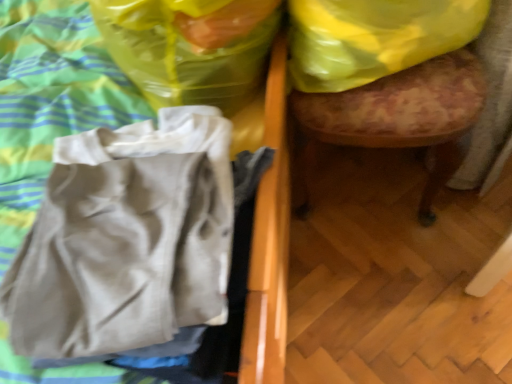
This screenshot has height=384, width=512. What are the coordinates of `beige cotton shirt at left` in the screenshot? It's located at (126, 239).

In order to face translucent yellow plastic bag at upper right, which ranks as the 1th plastic bag in left-to-right order, should I rotate leftwards or rightwards?

You should look left and rotate roughly 8.756 degrees.

This screenshot has height=384, width=512. In order to click on yellow plastic bag at upper right, the 2th plastic bag from the left in this screenshot , I will do `click(374, 38)`.

Would you say wooden upholstered stool at right is to the left or to the right of translucent yellow plastic bag at upper right, which ranks as the 1th plastic bag in left-to-right order, in the picture?

In the image, wooden upholstered stool at right appears on the right side of translucent yellow plastic bag at upper right, which ranks as the 1th plastic bag in left-to-right order.

Is wooden upholstered stool at right shorter than translucent yellow plastic bag at upper right, which ranks as the 2th plastic bag in right-to-left order?

No, wooden upholstered stool at right is not shorter than translucent yellow plastic bag at upper right, which ranks as the 2th plastic bag in right-to-left order.

Is translucent yellow plastic bag at upper right, which ranks as the 1th plastic bag in left-to-right order, surrounded by wooden upholstered stool at right?

That's incorrect, translucent yellow plastic bag at upper right, which ranks as the 1th plastic bag in left-to-right order, is not inside wooden upholstered stool at right.

In the scene shown: Considering the relative sizes of wooden upholstered stool at right and translucent yellow plastic bag at upper right, which ranks as the 2th plastic bag in right-to-left order, in the image provided, is wooden upholstered stool at right smaller than translucent yellow plastic bag at upper right, which ranks as the 2th plastic bag in right-to-left order,?

Incorrect, wooden upholstered stool at right is not smaller in size than translucent yellow plastic bag at upper right, which ranks as the 2th plastic bag in right-to-left order.

Considering the relative sizes of yellow plastic bag at upper right, the 2th plastic bag from the left, and wooden upholstered stool at right in the image provided, is yellow plastic bag at upper right, the 2th plastic bag from the left, wider than wooden upholstered stool at right?

In fact, yellow plastic bag at upper right, the 2th plastic bag from the left, might be narrower than wooden upholstered stool at right.

Consider the image. Is wooden upholstered stool at right at the back of yellow plastic bag at upper right, the 1th plastic bag viewed from the right?

Yes, yellow plastic bag at upper right, the 1th plastic bag viewed from the right, is positioned with its back facing wooden upholstered stool at right.

Is yellow plastic bag at upper right, the 2th plastic bag from the left, completely or partially outside of wooden upholstered stool at right?

Actually, yellow plastic bag at upper right, the 2th plastic bag from the left, is within wooden upholstered stool at right.

Which object is further away from the camera, yellow plastic bag at upper right, the 1th plastic bag viewed from the right, or wooden upholstered stool at right?

yellow plastic bag at upper right, the 1th plastic bag viewed from the right.

Consider the image. Measure the distance from translucent yellow plastic bag at upper right, which ranks as the 2th plastic bag in right-to-left order, to wooden upholstered stool at right.

They are 11.44 inches apart.

Is translucent yellow plastic bag at upper right, which ranks as the 2th plastic bag in right-to-left order, further to the viewer compared to wooden upholstered stool at right?

No, it is not.

From the image's perspective, which is below, translucent yellow plastic bag at upper right, which ranks as the 2th plastic bag in right-to-left order, or wooden upholstered stool at right?

From the image's view, wooden upholstered stool at right is below.

Is translucent yellow plastic bag at upper right, which ranks as the 1th plastic bag in left-to-right order, smaller than wooden upholstered stool at right?

Indeed, translucent yellow plastic bag at upper right, which ranks as the 1th plastic bag in left-to-right order, has a smaller size compared to wooden upholstered stool at right.

Which of these two, wooden upholstered stool at right or beige cotton shirt at left, is smaller?

beige cotton shirt at left is smaller.

Is wooden upholstered stool at right looking in the opposite direction of beige cotton shirt at left?

No, wooden upholstered stool at right's orientation is not away from beige cotton shirt at left.

From a real-world perspective, relative to beige cotton shirt at left, is wooden upholstered stool at right vertically above or below?

wooden upholstered stool at right is situated lower than beige cotton shirt at left in the real world.

From the picture: Between wooden upholstered stool at right and beige cotton shirt at left, which one has larger width?

With larger width is wooden upholstered stool at right.

From the picture: Which object is further away from the camera taking this photo, yellow plastic bag at upper right, the 2th plastic bag from the left, or translucent yellow plastic bag at upper right, which ranks as the 2th plastic bag in right-to-left order?

yellow plastic bag at upper right, the 2th plastic bag from the left, is behind.

Which point is more forward, (336,85) or (195,43)?

The point (195,43) is closer to the camera.

Considering the relative sizes of yellow plastic bag at upper right, the 2th plastic bag from the left, and translucent yellow plastic bag at upper right, which ranks as the 2th plastic bag in right-to-left order, in the image provided, is yellow plastic bag at upper right, the 2th plastic bag from the left, taller than translucent yellow plastic bag at upper right, which ranks as the 2th plastic bag in right-to-left order,?

In fact, yellow plastic bag at upper right, the 2th plastic bag from the left, may be shorter than translucent yellow plastic bag at upper right, which ranks as the 2th plastic bag in right-to-left order.

Are beige cotton shirt at left and wooden upholstered stool at right far apart?

They are positioned close to each other.

Is point (97, 198) positioned after point (431, 118)?

No, it is in front of (431, 118).

Is beige cotton shirt at left in front of wooden upholstered stool at right?

Yes, it is in front of wooden upholstered stool at right.

From a real-world perspective, does beige cotton shirt at left stand above wooden upholstered stool at right?

Correct, in the physical world, beige cotton shirt at left is higher than wooden upholstered stool at right.

Is wooden upholstered stool at right positioned far away from yellow plastic bag at upper right, the 2th plastic bag from the left?

No, there isn't a large distance between wooden upholstered stool at right and yellow plastic bag at upper right, the 2th plastic bag from the left.

Who is more distant, wooden upholstered stool at right or yellow plastic bag at upper right, the 1th plastic bag viewed from the right?

Positioned behind is yellow plastic bag at upper right, the 1th plastic bag viewed from the right.

From a real-world perspective, does wooden upholstered stool at right sit lower than yellow plastic bag at upper right, the 2th plastic bag from the left?

Yes, from a real-world perspective, wooden upholstered stool at right is under yellow plastic bag at upper right, the 2th plastic bag from the left.

Is wooden upholstered stool at right spatially inside yellow plastic bag at upper right, the 1th plastic bag viewed from the right, or outside of it?

wooden upholstered stool at right is not enclosed by yellow plastic bag at upper right, the 1th plastic bag viewed from the right.

Where is `the 2nd plastic bag to the left of the wooden upholstered stool at right, starting your count from the anchor`? the 2nd plastic bag to the left of the wooden upholstered stool at right, starting your count from the anchor is located at coordinates (190, 47).

Identify the location of plastic bag behind the wooden upholstered stool at right. (374, 38).

When comparing their distances from yellow plastic bag at upper right, the 2th plastic bag from the left, does wooden upholstered stool at right or translucent yellow plastic bag at upper right, which ranks as the 2th plastic bag in right-to-left order, seem closer?

Among the two, wooden upholstered stool at right is located nearer to yellow plastic bag at upper right, the 2th plastic bag from the left.

Which object lies further to the anchor point translucent yellow plastic bag at upper right, which ranks as the 2th plastic bag in right-to-left order, beige cotton shirt at left or yellow plastic bag at upper right, the 2th plastic bag from the left?

beige cotton shirt at left is further to translucent yellow plastic bag at upper right, which ranks as the 2th plastic bag in right-to-left order.

When comparing their distances from translucent yellow plastic bag at upper right, which ranks as the 2th plastic bag in right-to-left order, does wooden upholstered stool at right or beige cotton shirt at left seem closer?

beige cotton shirt at left is closer to translucent yellow plastic bag at upper right, which ranks as the 2th plastic bag in right-to-left order.

Considering their positions, is translucent yellow plastic bag at upper right, which ranks as the 2th plastic bag in right-to-left order, positioned closer to yellow plastic bag at upper right, the 2th plastic bag from the left, than wooden upholstered stool at right?

Based on the image, wooden upholstered stool at right appears to be nearer to yellow plastic bag at upper right, the 2th plastic bag from the left.

From the picture: Considering their positions, is beige cotton shirt at left positioned further to yellow plastic bag at upper right, the 2th plastic bag from the left, than wooden upholstered stool at right?

beige cotton shirt at left is positioned further to the anchor yellow plastic bag at upper right, the 2th plastic bag from the left.

From the image, which object appears to be farther from translucent yellow plastic bag at upper right, which ranks as the 1th plastic bag in left-to-right order, yellow plastic bag at upper right, the 1th plastic bag viewed from the right, or wooden upholstered stool at right?

wooden upholstered stool at right lies further to translucent yellow plastic bag at upper right, which ranks as the 1th plastic bag in left-to-right order, than the other object.

Which object lies further to the anchor point wooden upholstered stool at right, beige cotton shirt at left or yellow plastic bag at upper right, the 2th plastic bag from the left?

beige cotton shirt at left.

Based on their spatial positions, is translucent yellow plastic bag at upper right, which ranks as the 1th plastic bag in left-to-right order, or yellow plastic bag at upper right, the 1th plastic bag viewed from the right, further from beige cotton shirt at left?

yellow plastic bag at upper right, the 1th plastic bag viewed from the right.

This screenshot has width=512, height=384. In order to click on plastic bag between yellow plastic bag at upper right, the 1th plastic bag viewed from the right, and beige cotton shirt at left in the up-down direction in this screenshot , I will do `click(190, 47)`.

In order to click on plastic bag between translucent yellow plastic bag at upper right, which ranks as the 1th plastic bag in left-to-right order, and wooden upholstered stool at right from left to right in this screenshot , I will do [x=374, y=38].

The image size is (512, 384). Find the location of `furniture between yellow plastic bag at upper right, the 2th plastic bag from the left, and beige cotton shirt at left vertically`. furniture between yellow plastic bag at upper right, the 2th plastic bag from the left, and beige cotton shirt at left vertically is located at coordinates (403, 113).